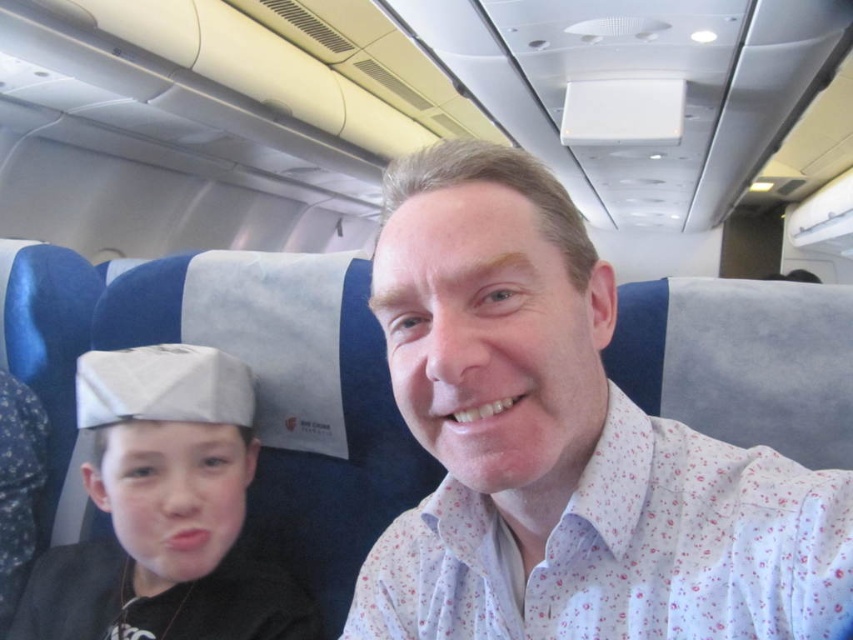
You are a flight attendant checking seat assignments. You see the white floral shirt at center and the gray fabric cap at left. According to the seating chart, passengers should be seated in order from left to right as per their ticket numbers. Which passenger is seated correctly based on their position?

The gray fabric cap at left is seated correctly because it is positioned to the left of the white floral shirt at center, aligning with the left to right seating order based on ticket numbers.

What is located at the coordinate point (x=564, y=445) in the airplane cabin image?

The white floral shirt at center is located at the coordinate point (x=564, y=445).

You are seated in the airplane cabin and want to hand a snack to the person wearing the white floral shirt at center. Based on their position, can you determine if they are sitting to your left or right?

The white floral shirt at center is located at point 0.697 on the x and 0.662 on the y coordinate. Since the x coordinate is greater than 0.5, the white floral shirt at center is to your right.